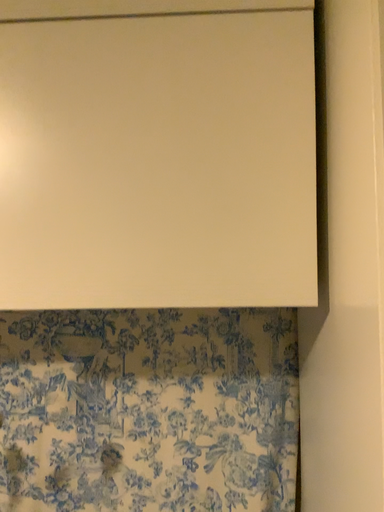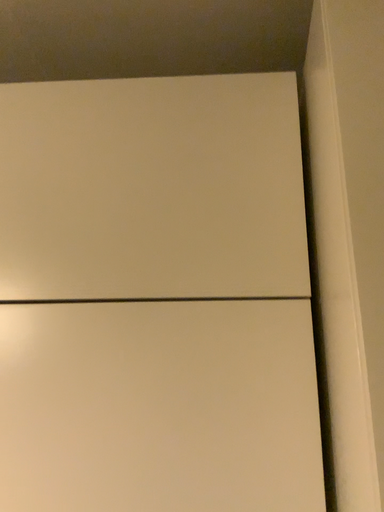
Question: How did the camera likely rotate when shooting the video?

Choices:
 (A) rotated upward
 (B) rotated downward

Answer: (A)